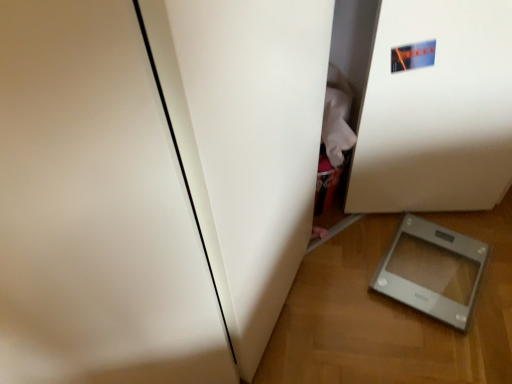
Describe the element at coordinates (432, 270) in the screenshot. I see `silver plastic scale at lower right` at that location.

You are a GUI agent. You are given a task and a screenshot of the screen. Output one action in this format:
    pyautogui.click(x=<x>, y=<y>)
    Task: Click on the silver plastic scale at lower right
    Image resolution: width=512 pixels, height=384 pixels.
    Given the screenshot: What is the action you would take?
    pyautogui.click(x=432, y=270)

Where is `silver plastic scale at lower right`? Image resolution: width=512 pixels, height=384 pixels. silver plastic scale at lower right is located at coordinates (432, 270).